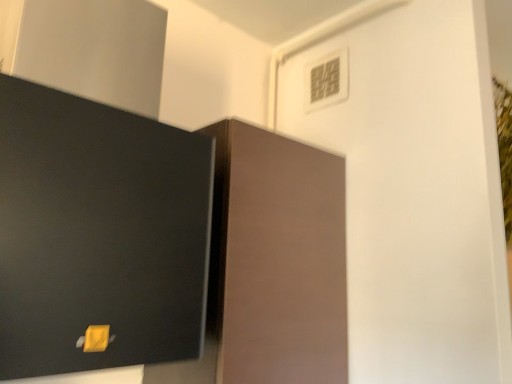
Question: Does matte brown cabinet at center contain white plastic light switch at upper center?

Choices:
 (A) no
 (B) yes

Answer: (A)

Question: Can you confirm if matte brown cabinet at center is wider than white plastic light switch at upper center?

Choices:
 (A) yes
 (B) no

Answer: (A)

Question: Is matte brown cabinet at center placed right next to white plastic light switch at upper center?

Choices:
 (A) no
 (B) yes

Answer: (A)

Question: Is matte brown cabinet at center oriented away from white plastic light switch at upper center?

Choices:
 (A) no
 (B) yes

Answer: (A)

Question: Is matte brown cabinet at center to the left of white plastic light switch at upper center from the viewer's perspective?

Choices:
 (A) yes
 (B) no

Answer: (A)

Question: From the image's perspective, does matte brown cabinet at center appear lower than white plastic light switch at upper center?

Choices:
 (A) yes
 (B) no

Answer: (A)

Question: From a real-world perspective, does white plastic light switch at upper center sit lower than matte brown cabinet at center?

Choices:
 (A) yes
 (B) no

Answer: (B)

Question: Could you tell me if white plastic light switch at upper center is turned towards matte brown cabinet at center?

Choices:
 (A) no
 (B) yes

Answer: (A)

Question: From the image's perspective, is white plastic light switch at upper center located beneath matte brown cabinet at center?

Choices:
 (A) yes
 (B) no

Answer: (B)

Question: Is white plastic light switch at upper center in front of matte brown cabinet at center?

Choices:
 (A) no
 (B) yes

Answer: (A)

Question: Is white plastic light switch at upper center surrounding matte brown cabinet at center?

Choices:
 (A) yes
 (B) no

Answer: (B)

Question: Does white plastic light switch at upper center have a smaller size compared to matte brown cabinet at center?

Choices:
 (A) yes
 (B) no

Answer: (A)

Question: Considering the positions of point (230, 215) and point (343, 56), is point (230, 215) closer or farther from the camera than point (343, 56)?

Choices:
 (A) closer
 (B) farther

Answer: (A)